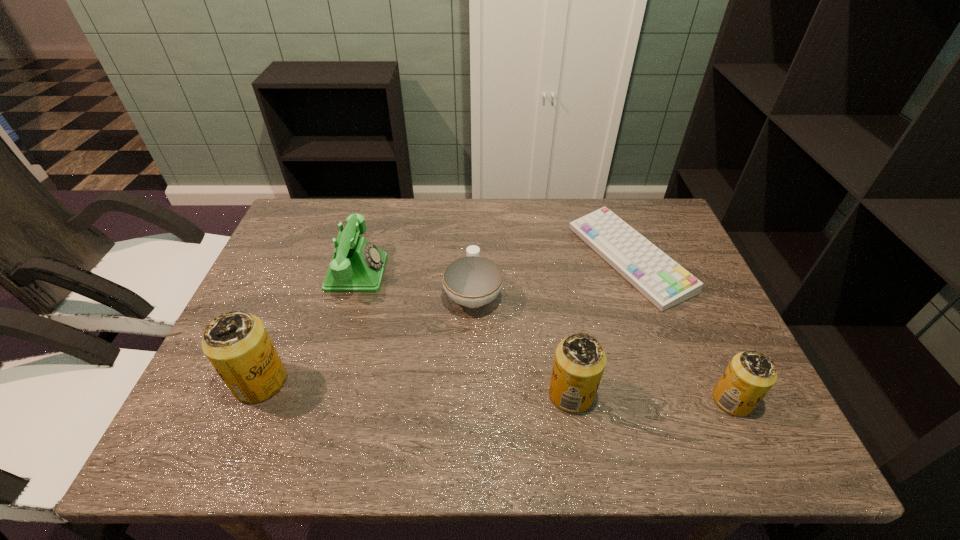
The width and height of the screenshot is (960, 540). I want to click on computer keyboard at the right edge, so click(x=665, y=283).

Locate an element on the screen. The image size is (960, 540). object positioned at the near left corner is located at coordinates (237, 344).

Locate an element on the screen. This screenshot has height=540, width=960. object situated at the far right corner is located at coordinates (665, 283).

The height and width of the screenshot is (540, 960). What are the coordinates of `object that is positioned at the near right corner` in the screenshot? It's located at (749, 376).

Locate an element on the screen. free space at the far edge is located at coordinates (438, 203).

What are the coordinates of `vacant space at the near edge of the desktop` in the screenshot? It's located at coord(386,381).

Identify the location of vacant space at the left edge. (244, 309).

Where is `vacant space at the far left corner`? vacant space at the far left corner is located at coordinates (303, 210).

Where is `vacant area at the far right corner`? vacant area at the far right corner is located at coordinates (667, 222).

The height and width of the screenshot is (540, 960). What are the coordinates of `unoccupied area between the computer keyboard and the leftmost object` in the screenshot? It's located at (444, 320).